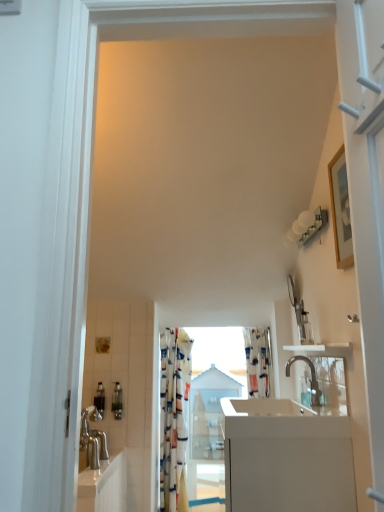
Question: Is metallic silver soap dispenser at lower left, arranged as the 2th toiletry when viewed from the left, situated inside patterned fabric curtain at center or outside?

Choices:
 (A) inside
 (B) outside

Answer: (B)

Question: From the image's perspective, is metallic silver soap dispenser at lower left, arranged as the 2th toiletry when viewed from the left, located above or below patterned fabric curtain at center?

Choices:
 (A) below
 (B) above

Answer: (B)

Question: Which object is the closest to the white glossy counter at center?

Choices:
 (A) clear glass mirror at right
 (B) white glossy sink at lower center
 (C) metallic silver soap dispenser at lower left, which ranks as the 1th toiletry in left-to-right order
 (D) printed fabric shower curtain at center
 (E) metallic silver soap dispenser at lower left, the first toiletry from the right

Answer: (B)

Question: Considering the real-world distances, which object is closest to the metallic silver soap dispenser at lower left, which ranks as the second toiletry in right-to-left order?

Choices:
 (A) white glossy sink at lower center
 (B) white glossy counter at center
 (C) printed fabric shower curtain at center
 (D) metallic silver soap dispenser at lower left, arranged as the 2th toiletry when viewed from the left
 (E) patterned fabric curtain at center

Answer: (D)